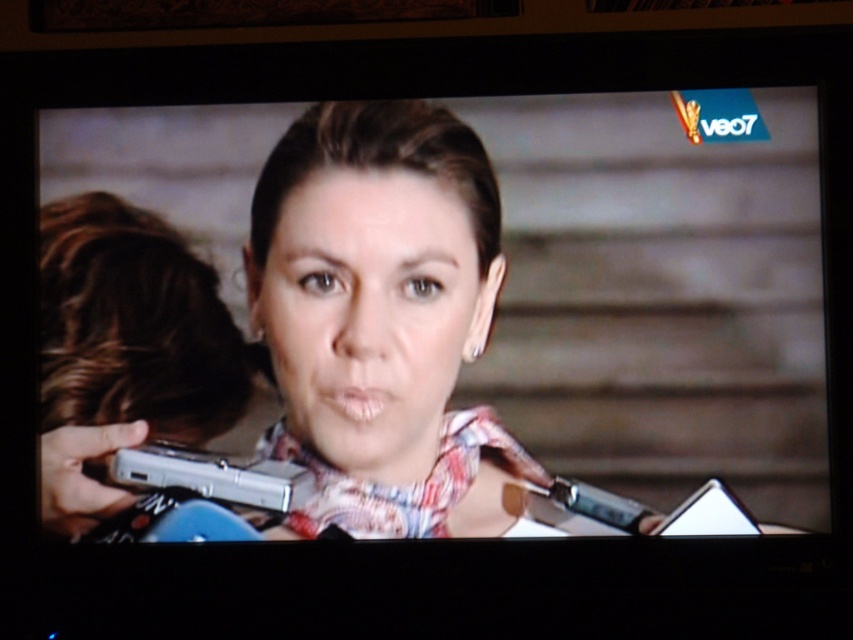
Who is positioned more to the right, matte pink scarf at center or shiny silver phone at left?

Positioned to the right is matte pink scarf at center.

Is point (375, 492) closer to camera compared to point (65, 304)?

That is True.

Locate an element on the screen. The height and width of the screenshot is (640, 853). matte pink scarf at center is located at coordinates (381, 320).

Who is positioned more to the left, matte skin face at center or shiny silver phone at left?

Positioned to the left is shiny silver phone at left.

Does matte skin face at center have a larger size compared to shiny silver phone at left?

Indeed, matte skin face at center has a larger size compared to shiny silver phone at left.

I want to click on matte skin face at center, so click(370, 314).

Where is `matte skin face at center`? This screenshot has width=853, height=640. matte skin face at center is located at coordinates (370, 314).

Between matte pink scarf at center and matte skin face at center, which one has more height?

matte pink scarf at center is taller.

Can you confirm if matte pink scarf at center is smaller than matte skin face at center?

Incorrect, matte pink scarf at center is not smaller in size than matte skin face at center.

Which is behind, point (384, 275) or point (316, 184)?

The point (316, 184) is behind.

Image resolution: width=853 pixels, height=640 pixels. Identify the location of matte pink scarf at center. (381, 320).